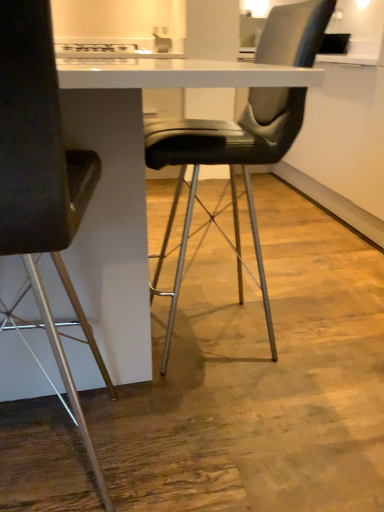
I want to click on free space underneath black leather chair at center, the first chair positioned from the right (from a real-world perspective), so click(x=255, y=326).